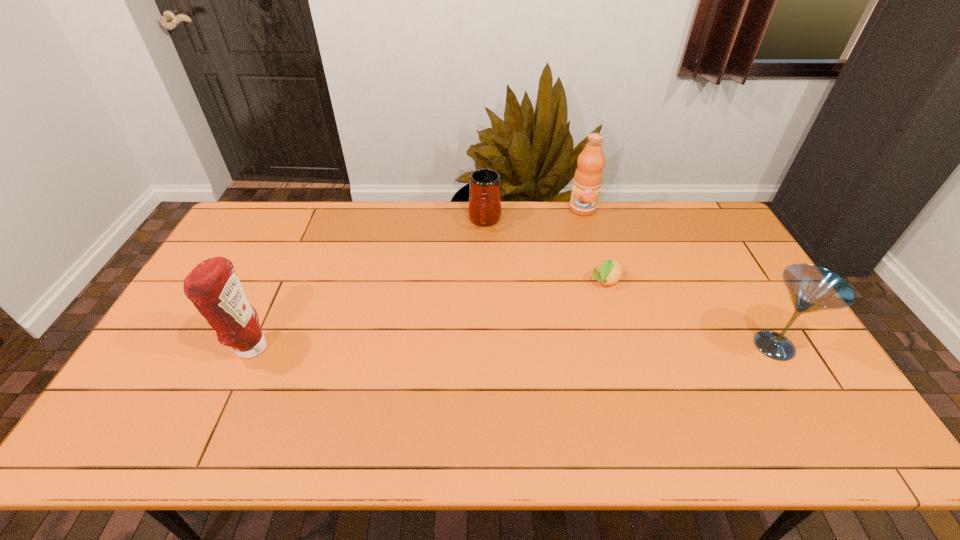
In order to click on the leftmost object in this screenshot , I will do `click(213, 286)`.

This screenshot has height=540, width=960. Find the location of `the rightmost object`. the rightmost object is located at coordinates (811, 288).

This screenshot has width=960, height=540. What are the coordinates of `martini` in the screenshot? It's located at (811, 288).

Where is `the third farthest object`? This screenshot has height=540, width=960. the third farthest object is located at coordinates point(610,271).

Where is `lemon`? lemon is located at coordinates (610, 271).

Find the location of a particular element. The image size is (960, 540). fruit juice is located at coordinates point(588,176).

The width and height of the screenshot is (960, 540). I want to click on the second object from left to right, so click(484, 209).

Where is `the fourth tallest object`? The image size is (960, 540). the fourth tallest object is located at coordinates (484, 209).

Locate an element on the screen. The height and width of the screenshot is (540, 960). free region located on the back of the condiment is located at coordinates tap(268, 309).

Identify the location of free space located on the left of the rightmost object. [x=695, y=346].